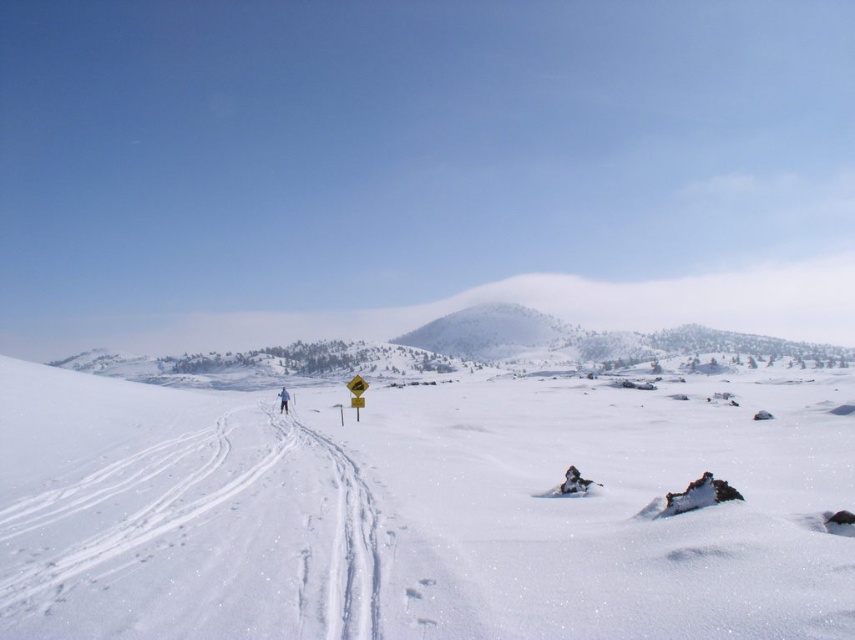
Between point (848, 509) and point (469, 326), which one is positioned in front?

Positioned in front is point (848, 509).

You are a GUI agent. You are given a task and a screenshot of the screen. Output one action in this format:
    pyautogui.click(x=<x>, y=<y>)
    Task: Click on the white snow ski slope at center
    The height and width of the screenshot is (640, 855).
    Given the screenshot: What is the action you would take?
    pyautogui.click(x=417, y=513)

From the picture: Does white snow-covered mountain at center appear under blue fabric jacket at center?

Actually, white snow-covered mountain at center is above blue fabric jacket at center.

Between white snow-covered mountain at center and blue fabric jacket at center, which one is positioned higher?

white snow-covered mountain at center

Does point (482, 307) lie in front of point (279, 396)?

No, (482, 307) is further to viewer.

The image size is (855, 640). Find the location of `white snow-covered mountain at center`. white snow-covered mountain at center is located at coordinates (490, 332).

Which of these two, white snow ski slope at center or blue fabric jacket at center, stands shorter?

With less height is blue fabric jacket at center.

Can you confirm if white snow ski slope at center is positioned below blue fabric jacket at center?

No.

Does point (192, 531) come behind point (284, 406)?

No, (192, 531) is in front of (284, 406).

Where is `white snow ski slope at center`? white snow ski slope at center is located at coordinates (417, 513).